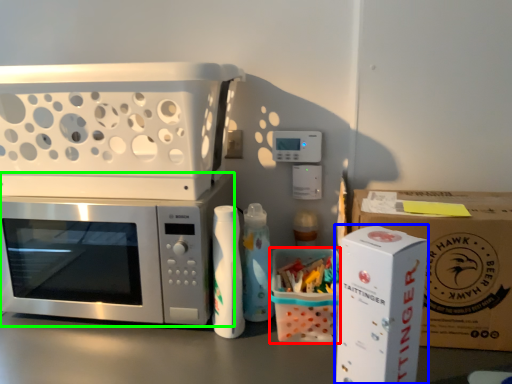
Question: Considering the real-world distances, which object is closest to cardboard box (highlighted by a red box)? appliance (highlighted by a blue box) or microwave oven (highlighted by a green box).

Choices:
 (A) appliance
 (B) microwave oven

Answer: (A)